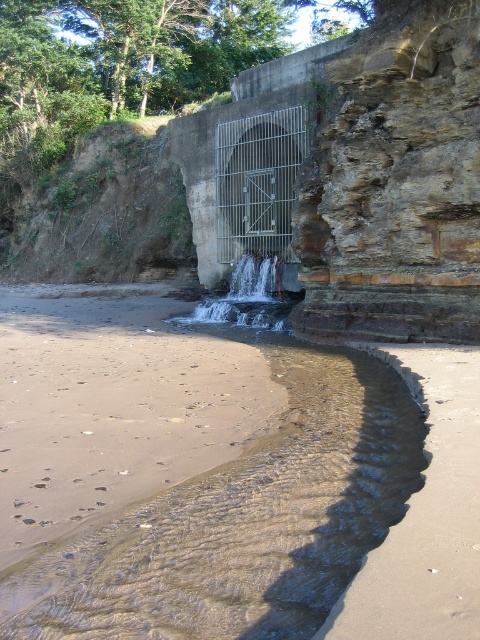
Question: Which object is closer to the camera taking this photo?

Choices:
 (A) clear sand at lower left
 (B) metal/cage at center

Answer: (A)

Question: Is clear sand at lower left behind metal/cage at center?

Choices:
 (A) yes
 (B) no

Answer: (B)

Question: Is metal/cage at center wider than clear glass waterfall at center?

Choices:
 (A) no
 (B) yes

Answer: (B)

Question: Considering the relative positions of metal/cage at center and clear glass waterfall at center in the image provided, where is metal/cage at center located with respect to clear glass waterfall at center?

Choices:
 (A) left
 (B) right

Answer: (B)

Question: Which of these objects is positioned farthest from the sandy brown at lower right?

Choices:
 (A) metal/cage at center
 (B) clear sand at lower left
 (C) brown sandy beach at lower left
 (D) clear glass waterfall at center

Answer: (A)

Question: Which point is closer to the camera?

Choices:
 (A) clear glass waterfall at center
 (B) brown sandy beach at lower left
 (C) metal/cage at center

Answer: (B)